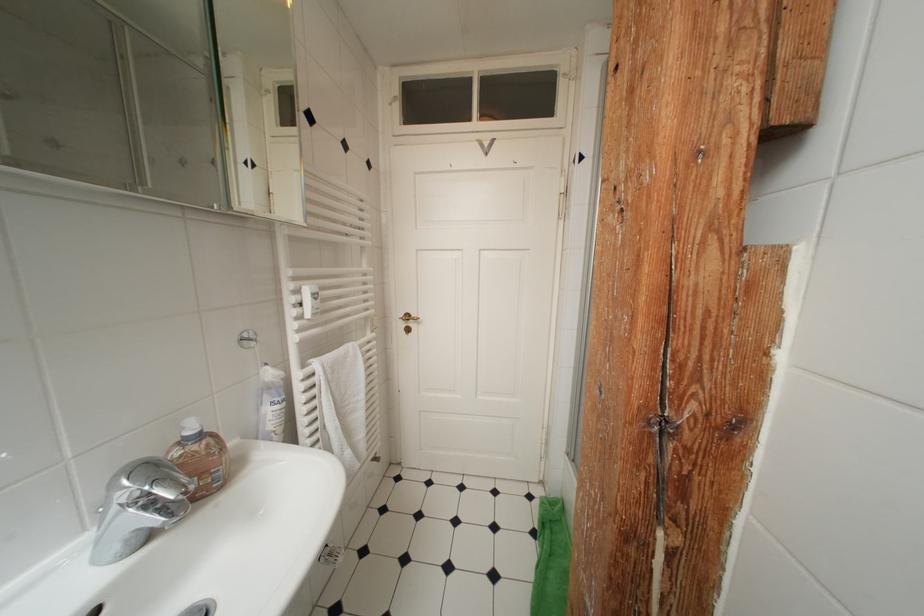
I want to click on spray bottle trigger, so click(200, 458).